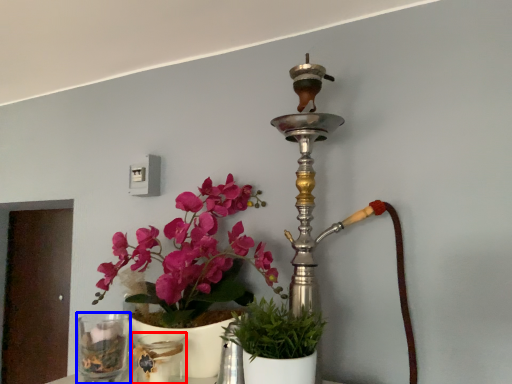
Question: Which point is closer to the camera, glass vase (highlighted by a red box) or vase (highlighted by a blue box)?

Choices:
 (A) glass vase
 (B) vase

Answer: (A)